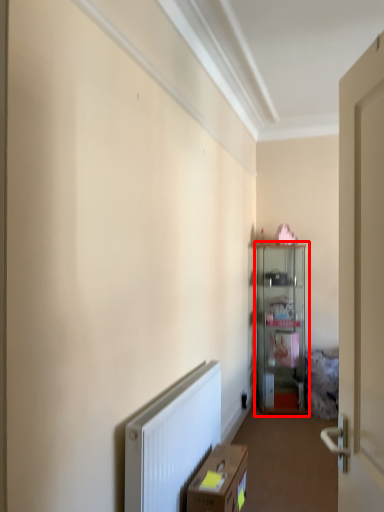
Question: From the image's perspective, where is cabinetry (annotated by the red box) located in relation to cardboard box in the image?

Choices:
 (A) above
 (B) below

Answer: (A)